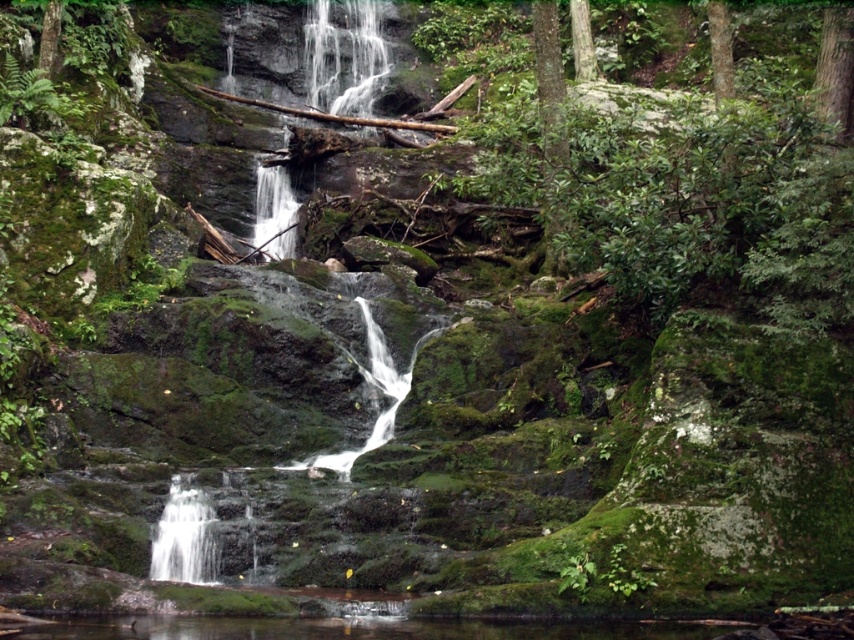
Which of these two, clear water at center or green mossy tree at upper right, stands shorter?

With less height is green mossy tree at upper right.

Does clear water at center appear on the right side of green mossy tree at upper right?

No, clear water at center is not to the right of green mossy tree at upper right.

Between point (342, 64) and point (545, 60), which one is positioned in front?

Point (545, 60) is more forward.

This screenshot has height=640, width=854. I want to click on clear water at center, so click(x=344, y=54).

Which is more to the right, white smooth waterfall at lower left or green rough bark tree at upper right?

green rough bark tree at upper right is more to the right.

Consider the image. Which of these two, white smooth waterfall at lower left or green rough bark tree at upper right, stands taller?

Standing taller between the two is green rough bark tree at upper right.

Measure the distance between point (196,554) and camera.

The distance of point (196,554) from camera is 35.86 meters.

What are the coordinates of `white smooth waterfall at lower left` in the screenshot? It's located at (185, 534).

Can you confirm if white smooth waterfall at lower left is wider than green mossy tree at upper right?

Yes.

You are a GUI agent. You are given a task and a screenshot of the screen. Output one action in this format:
    pyautogui.click(x=<x>, y=<y>)
    Task: Click on the white smooth waterfall at lower left
    This screenshot has width=854, height=640.
    Given the screenshot: What is the action you would take?
    pyautogui.click(x=185, y=534)

Does point (188, 563) come in front of point (559, 259)?

Yes, it is in front of point (559, 259).

Where is `white smooth waterfall at lower left`? The width and height of the screenshot is (854, 640). white smooth waterfall at lower left is located at coordinates (185, 534).